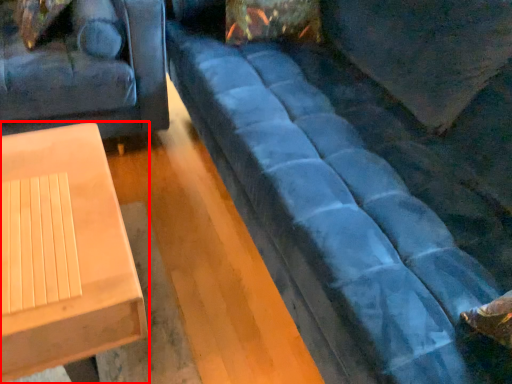
Question: From the image's perspective, where is table (annotated by the red box) located relative to studio couch?

Choices:
 (A) below
 (B) above

Answer: (A)